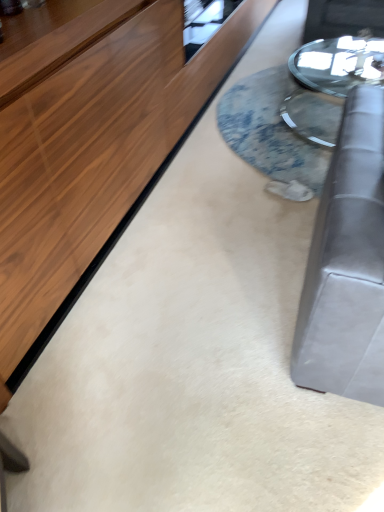
The height and width of the screenshot is (512, 384). Describe the element at coordinates (329, 83) in the screenshot. I see `clear glass table at center, which ranks as the second table in left-to-right order` at that location.

This screenshot has width=384, height=512. Find the location of `clear glass table at center, the first table when ordered from right to left`. clear glass table at center, the first table when ordered from right to left is located at coordinates (329, 83).

What is the approximate width of translucent glass table at center, which appears as the second table when viewed from the right?

The width of translucent glass table at center, which appears as the second table when viewed from the right, is 2.02 meters.

Describe the element at coordinates (278, 127) in the screenshot. Image resolution: width=384 pixels, height=512 pixels. I see `translucent glass table at center, which appears as the second table when viewed from the right` at that location.

This screenshot has width=384, height=512. Identify the location of translucent glass table at center, which appears as the second table when viewed from the right. (278, 127).

How much space does translucent glass table at center, which appears as the second table when viewed from the right, occupy vertically?

7.49 centimeters.

Where is `clear glass table at center, the first table when ordered from right to left`? This screenshot has height=512, width=384. clear glass table at center, the first table when ordered from right to left is located at coordinates (329, 83).

Is translucent glass table at center, marked as the 1th table in a left-to-right arrangement, at the right side of clear glass table at center, which ranks as the second table in left-to-right order?

In fact, translucent glass table at center, marked as the 1th table in a left-to-right arrangement, is to the left of clear glass table at center, which ranks as the second table in left-to-right order.

Between translucent glass table at center, marked as the 1th table in a left-to-right arrangement, and clear glass table at center, the first table when ordered from right to left, which one is positioned behind?

clear glass table at center, the first table when ordered from right to left, is more distant.

Between point (286, 70) and point (283, 106), which one is positioned in front?

Positioned in front is point (283, 106).

From the image's perspective, is translucent glass table at center, marked as the 1th table in a left-to-right arrangement, on clear glass table at center, which ranks as the second table in left-to-right order?

No, from the image's perspective, translucent glass table at center, marked as the 1th table in a left-to-right arrangement, is not over clear glass table at center, which ranks as the second table in left-to-right order.

From a real-world perspective, relative to clear glass table at center, which ranks as the second table in left-to-right order, is translucent glass table at center, which appears as the second table when viewed from the right, vertically above or below?

translucent glass table at center, which appears as the second table when viewed from the right, is below clear glass table at center, which ranks as the second table in left-to-right order.

Which object is wider, translucent glass table at center, which appears as the second table when viewed from the right, or clear glass table at center, the first table when ordered from right to left?

With larger width is translucent glass table at center, which appears as the second table when viewed from the right.

Is translucent glass table at center, marked as the 1th table in a left-to-right arrangement, taller or shorter than clear glass table at center, which ranks as the second table in left-to-right order?

translucent glass table at center, marked as the 1th table in a left-to-right arrangement, is shorter than clear glass table at center, which ranks as the second table in left-to-right order.

Considering the sizes of objects translucent glass table at center, which appears as the second table when viewed from the right, and clear glass table at center, the first table when ordered from right to left, in the image provided, who is bigger, translucent glass table at center, which appears as the second table when viewed from the right, or clear glass table at center, the first table when ordered from right to left,?

clear glass table at center, the first table when ordered from right to left, is bigger.

Does translucent glass table at center, which appears as the second table when viewed from the right, contain clear glass table at center, the first table when ordered from right to left?

No, clear glass table at center, the first table when ordered from right to left, is located outside of translucent glass table at center, which appears as the second table when viewed from the right.

Based on the photo, is translucent glass table at center, marked as the 1th table in a left-to-right arrangement, not near clear glass table at center, the first table when ordered from right to left?

They are positioned close to each other.

Could you tell me if translucent glass table at center, which appears as the second table when viewed from the right, is turned towards clear glass table at center, the first table when ordered from right to left?

Yes, translucent glass table at center, which appears as the second table when viewed from the right, is aimed at clear glass table at center, the first table when ordered from right to left.

Where is `table above the translucent glass table at center, which appears as the second table when viewed from the right (from the image's perspective)`? The width and height of the screenshot is (384, 512). table above the translucent glass table at center, which appears as the second table when viewed from the right (from the image's perspective) is located at coordinates (329, 83).

Can you confirm if clear glass table at center, which ranks as the second table in left-to-right order, is positioned to the left of translucent glass table at center, which appears as the second table when viewed from the right?

Incorrect, clear glass table at center, which ranks as the second table in left-to-right order, is not on the left side of translucent glass table at center, which appears as the second table when viewed from the right.

Does clear glass table at center, the first table when ordered from right to left, come behind translucent glass table at center, marked as the 1th table in a left-to-right arrangement?

That is True.

Between point (373, 65) and point (254, 123), which one is positioned behind?

Positioned behind is point (254, 123).

From the image's perspective, which one is positioned higher, clear glass table at center, the first table when ordered from right to left, or translucent glass table at center, marked as the 1th table in a left-to-right arrangement?

From the image's view, clear glass table at center, the first table when ordered from right to left, is above.

From a real-world perspective, is clear glass table at center, which ranks as the second table in left-to-right order, above or below translucent glass table at center, marked as the 1th table in a left-to-right arrangement?

In terms of real-world spatial position, clear glass table at center, which ranks as the second table in left-to-right order, is above translucent glass table at center, marked as the 1th table in a left-to-right arrangement.

Considering the sizes of objects clear glass table at center, the first table when ordered from right to left, and translucent glass table at center, marked as the 1th table in a left-to-right arrangement, in the image provided, who is wider, clear glass table at center, the first table when ordered from right to left, or translucent glass table at center, marked as the 1th table in a left-to-right arrangement,?

With larger width is translucent glass table at center, marked as the 1th table in a left-to-right arrangement.

Considering the relative sizes of clear glass table at center, the first table when ordered from right to left, and translucent glass table at center, which appears as the second table when viewed from the right, in the image provided, is clear glass table at center, the first table when ordered from right to left, taller than translucent glass table at center, which appears as the second table when viewed from the right,?

Correct, clear glass table at center, the first table when ordered from right to left, is much taller as translucent glass table at center, which appears as the second table when viewed from the right.

Is clear glass table at center, the first table when ordered from right to left, bigger than translucent glass table at center, marked as the 1th table in a left-to-right arrangement?

Yes, clear glass table at center, the first table when ordered from right to left, is bigger than translucent glass table at center, marked as the 1th table in a left-to-right arrangement.

Choose the correct answer: Is clear glass table at center, the first table when ordered from right to left, inside translucent glass table at center, which appears as the second table when viewed from the right, or outside it?

clear glass table at center, the first table when ordered from right to left, is not enclosed by translucent glass table at center, which appears as the second table when viewed from the right.

Would you consider clear glass table at center, which ranks as the second table in left-to-right order, to be distant from translucent glass table at center, which appears as the second table when viewed from the right?

They are positioned close to each other.

Is clear glass table at center, which ranks as the second table in left-to-right order, facing towards translucent glass table at center, marked as the 1th table in a left-to-right arrangement?

No, clear glass table at center, which ranks as the second table in left-to-right order, is not oriented towards translucent glass table at center, marked as the 1th table in a left-to-right arrangement.

What's the angular difference between clear glass table at center, the first table when ordered from right to left, and translucent glass table at center, marked as the 1th table in a left-to-right arrangement,'s facing directions?

The angle between the facing direction of clear glass table at center, the first table when ordered from right to left, and the facing direction of translucent glass table at center, marked as the 1th table in a left-to-right arrangement, is 89.4 degrees.

Measure the distance between clear glass table at center, which ranks as the second table in left-to-right order, and translucent glass table at center, marked as the 1th table in a left-to-right arrangement.

clear glass table at center, which ranks as the second table in left-to-right order, is 7.63 inches away from translucent glass table at center, marked as the 1th table in a left-to-right arrangement.

You are a GUI agent. You are given a task and a screenshot of the screen. Output one action in this format:
    pyautogui.click(x=<x>, y=<y>)
    Task: Click on the table on the left side of clear glass table at center, which ranks as the second table in left-to-right order
    This screenshot has width=384, height=512.
    Given the screenshot: What is the action you would take?
    pyautogui.click(x=278, y=127)

Image resolution: width=384 pixels, height=512 pixels. In the image, there is a translucent glass table at center, marked as the 1th table in a left-to-right arrangement. What are the coordinates of `table above it (from the image's perspective)` in the screenshot? It's located at (329, 83).

Identify the location of table on the right of translucent glass table at center, marked as the 1th table in a left-to-right arrangement. (329, 83).